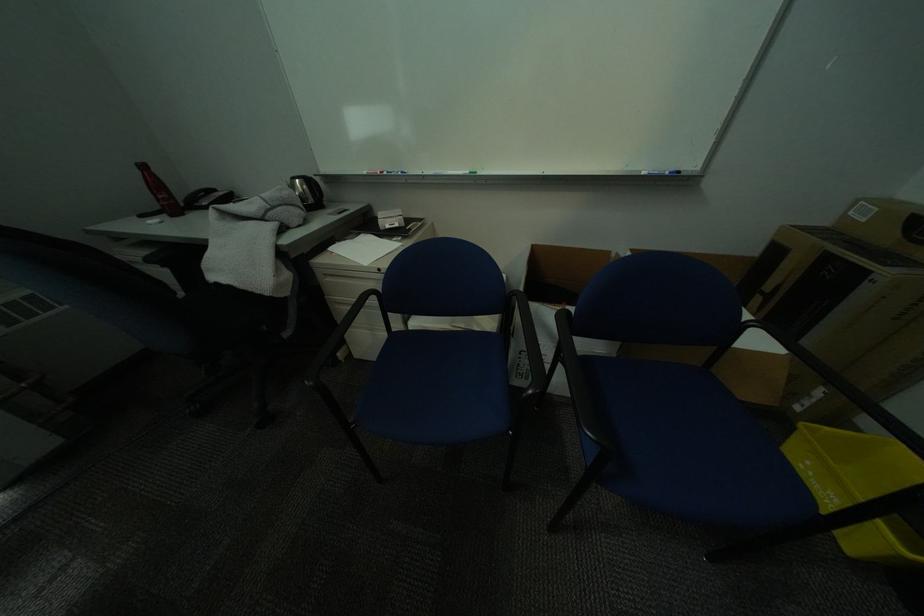
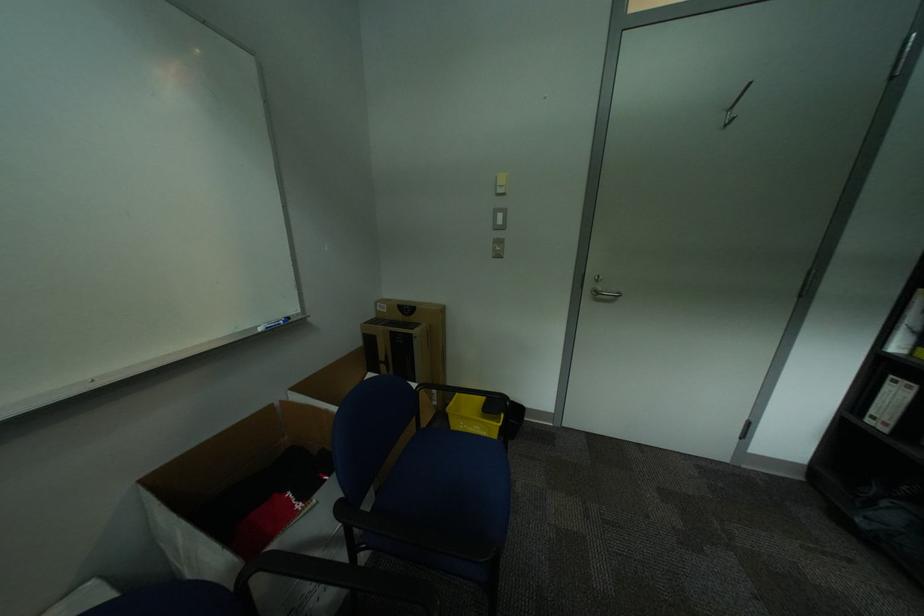
Where in the second image is the point corresponding to the point at 809,410 from the first image?

(445, 403)